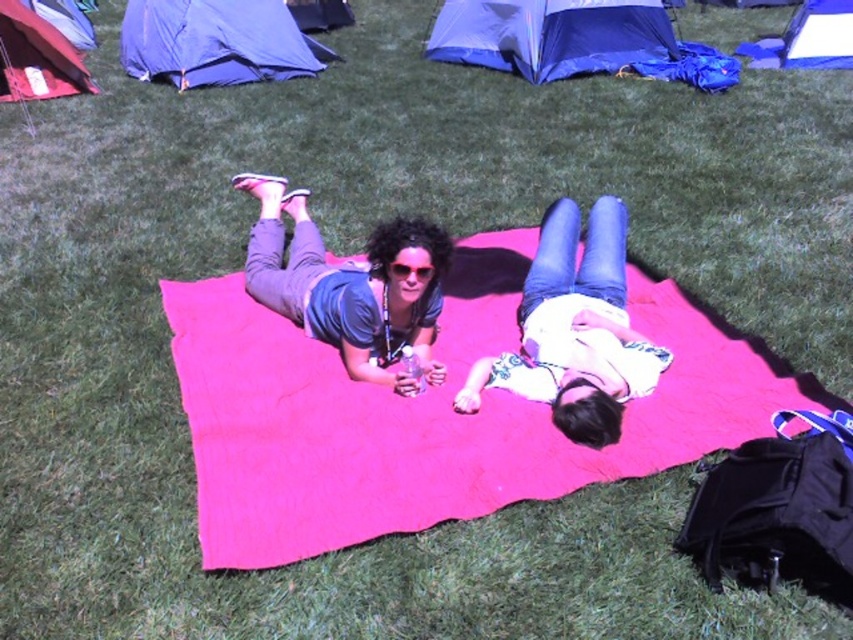
Question: Is blue fabric tent at upper left to the right of blue fabric tent at upper center from the viewer's perspective?

Choices:
 (A) yes
 (B) no

Answer: (B)

Question: Which object is closer to the camera taking this photo?

Choices:
 (A) matte blue tent at upper left
 (B) white matte shirt at center

Answer: (B)

Question: Is pink fabric blanket at center in front of blue fabric tent at upper left?

Choices:
 (A) yes
 (B) no

Answer: (A)

Question: Based on their relative distances, which object is nearer to the pink fabric blanket at center?

Choices:
 (A) blue fabric tent at upper right
 (B) blue tarpaulin tent at upper center
 (C) blue fabric tent at upper left
 (D) white matte shirt at center

Answer: (D)

Question: Which of the following is the closest to the observer?

Choices:
 (A) pyautogui.click(x=747, y=42)
 (B) pyautogui.click(x=624, y=266)
 (C) pyautogui.click(x=416, y=257)

Answer: (C)

Question: Is the position of pink fabric blanket at center more distant than that of blue tarpaulin tent at upper center?

Choices:
 (A) no
 (B) yes

Answer: (A)